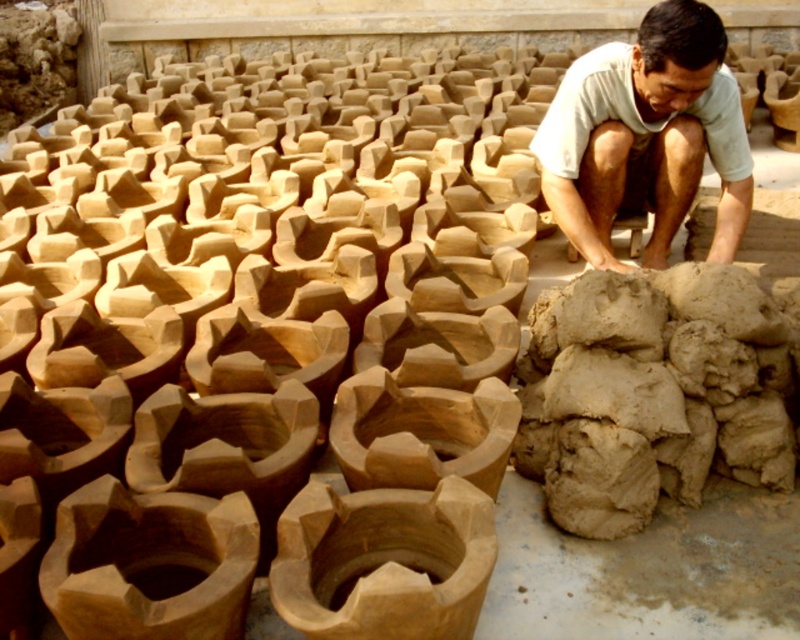
You are a pottery apprentice observing the scene. You need to locate the clay to start molding a new pot. According to the coordinates provided, where exactly is the clay at lower right positioned in the image?

The clay at lower right is positioned at coordinates point (x=652, y=392).

You are a pottery assistant and need to determine which clay area is wider. You see the clay at lower right and the light brown clay at center. Which one is wider?

The clay at lower right might be wider than light brown clay at center.

You are standing at the camera position and want to reach the clay at lower right without moving your feet. Can you do it?

The distance between you and the clay at lower right is 7.75 feet, so you cannot reach it without moving your feet because that distance is too far to reach comfortably.